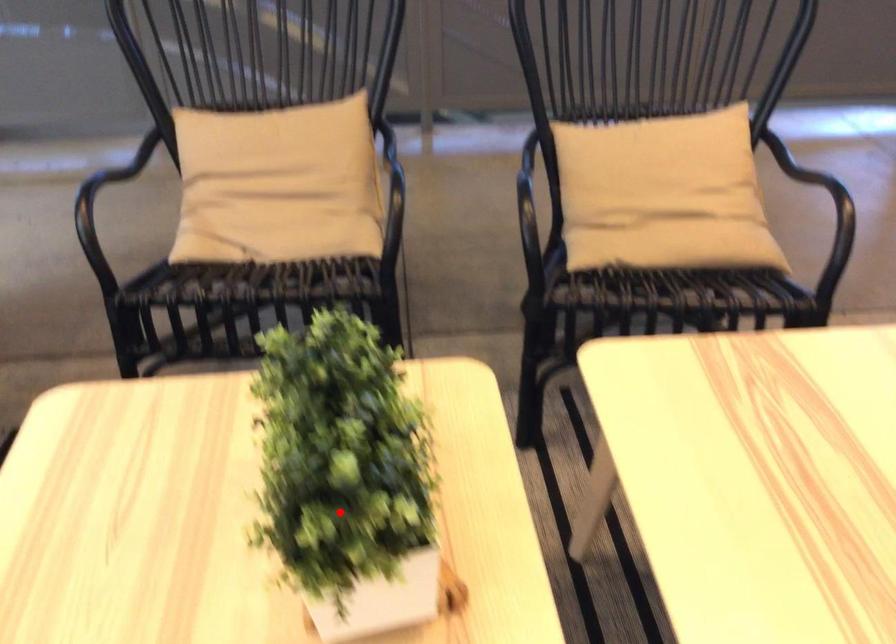
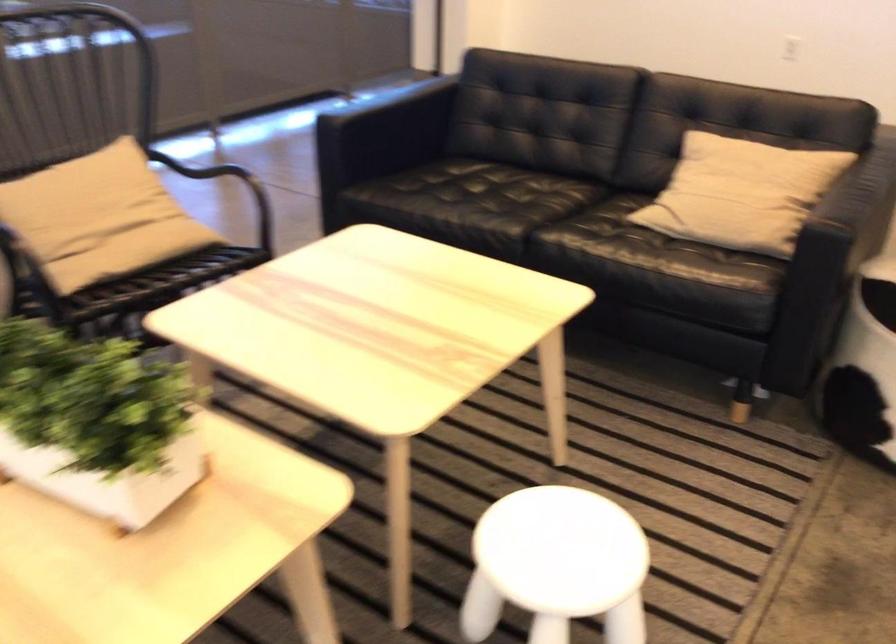
In the second image, find the point that corresponds to the highlighted location in the first image.

(96, 422)